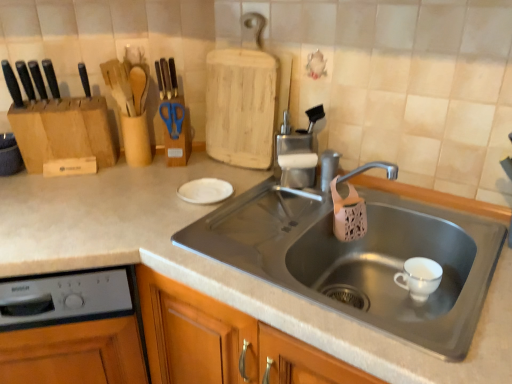
Question: Is point (19, 94) positioned closer to the camera than point (31, 64)?

Choices:
 (A) closer
 (B) farther

Answer: (A)

Question: Considering their positions, is black matte knife at left, positioned as the third knife in right-to-left order, located in front of or behind black matte knife at left, positioned as the first knife in right-to-left order?

Choices:
 (A) behind
 (B) front

Answer: (B)

Question: Which of these objects is positioned farthest from the blue plastic scissors at upper center?

Choices:
 (A) gray plastic dishwasher at lower left
 (B) black matte knife at left, positioned as the third knife in right-to-left order
 (C) black matte knife at left, which is the third knife from left to right
 (D) black plastic knife at left, marked as the 2th knife in a right-to-left arrangement
 (E) metallic gray sink at center

Answer: (A)

Question: Which is nearer to the black plastic knife at left, marked as the 2th knife in a right-to-left arrangement?

Choices:
 (A) metallic gray sink at center
 (B) black matte knife at left, the first knife positioned from the left
 (C) black matte knife at left, which is the third knife from left to right
 (D) gray plastic dishwasher at lower left
 (E) blue plastic scissors at upper center

Answer: (C)